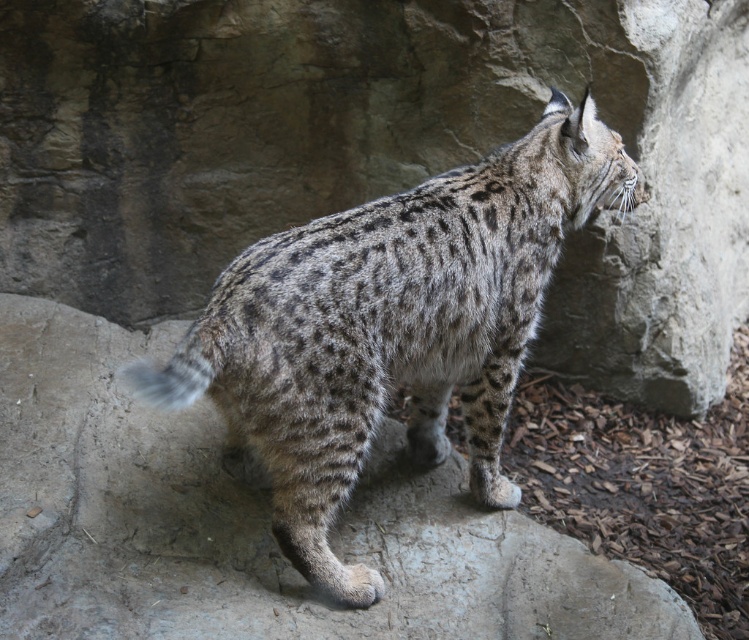
You are a zookeeper trying to observe the spotted fur cat at center from a safe distance. You notice a gray textured rock at center in the enclosure. Which object is closer to you, the zookeeper?

The gray textured rock at center is closer to you than the spotted fur cat at center because it is further to the viewer.

You are a zookeeper observing the enclosure. You notice the gray textured rock at center and the spotted fur cat at center. Which object is positioned to the left of the other?

The gray textured rock at center is to the left of the spotted fur cat at center.